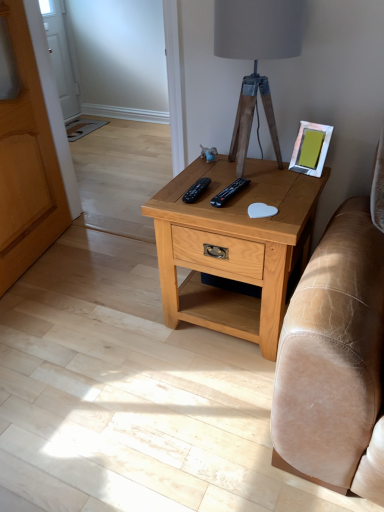
Question: Would you say black plastic remote at center, which is the second remote in left-to-right order, contains light brown wood nightstand at center?

Choices:
 (A) no
 (B) yes

Answer: (A)

Question: Is black plastic remote at center, which is the second remote in left-to-right order, aimed at light brown wood nightstand at center?

Choices:
 (A) no
 (B) yes

Answer: (A)

Question: Can you confirm if black plastic remote at center, which is the second remote in left-to-right order, is shorter than light brown wood nightstand at center?

Choices:
 (A) yes
 (B) no

Answer: (A)

Question: Considering the relative positions of black plastic remote at center, which is the 1th remote in right-to-left order, and light brown wood nightstand at center in the image provided, is black plastic remote at center, which is the 1th remote in right-to-left order, to the right of light brown wood nightstand at center from the viewer's perspective?

Choices:
 (A) yes
 (B) no

Answer: (B)

Question: From a real-world perspective, is black plastic remote at center, which is the second remote in left-to-right order, below light brown wood nightstand at center?

Choices:
 (A) yes
 (B) no

Answer: (B)

Question: From the image's perspective, is light brown wood nightstand at center positioned above or below metallic silver picture frame at upper right?

Choices:
 (A) below
 (B) above

Answer: (A)

Question: Considering the positions of light brown wood nightstand at center and metallic silver picture frame at upper right in the image, is light brown wood nightstand at center taller or shorter than metallic silver picture frame at upper right?

Choices:
 (A) short
 (B) tall

Answer: (B)

Question: Based on their positions, is light brown wood nightstand at center located to the left or right of metallic silver picture frame at upper right?

Choices:
 (A) right
 (B) left

Answer: (B)

Question: From a real-world perspective, is light brown wood nightstand at center physically located above or below metallic silver picture frame at upper right?

Choices:
 (A) below
 (B) above

Answer: (A)

Question: Is point (306, 133) positioned closer to the camera than point (291, 20)?

Choices:
 (A) farther
 (B) closer

Answer: (A)

Question: In the image, is metallic silver picture frame at upper right positioned in front of or behind wooden tripod lamp at center?

Choices:
 (A) front
 (B) behind

Answer: (B)

Question: In terms of height, does metallic silver picture frame at upper right look taller or shorter compared to wooden tripod lamp at center?

Choices:
 (A) tall
 (B) short

Answer: (B)

Question: From a real-world perspective, is metallic silver picture frame at upper right positioned above or below wooden tripod lamp at center?

Choices:
 (A) above
 (B) below

Answer: (B)

Question: In the image, is wooden armoire at left on the left side or the right side of metallic silver picture frame at upper right?

Choices:
 (A) right
 (B) left

Answer: (B)

Question: From a real-world perspective, relative to metallic silver picture frame at upper right, is wooden armoire at left vertically above or below?

Choices:
 (A) above
 (B) below

Answer: (B)